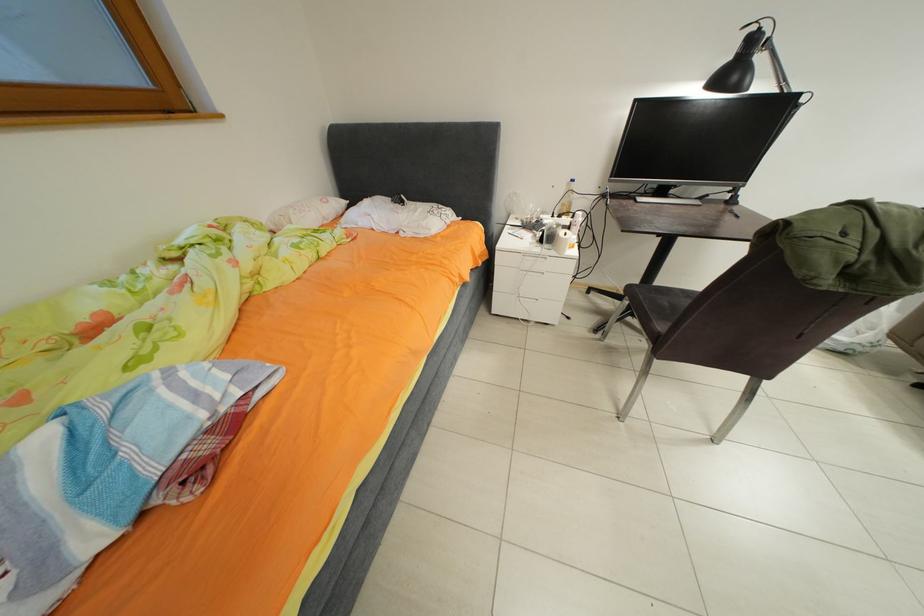
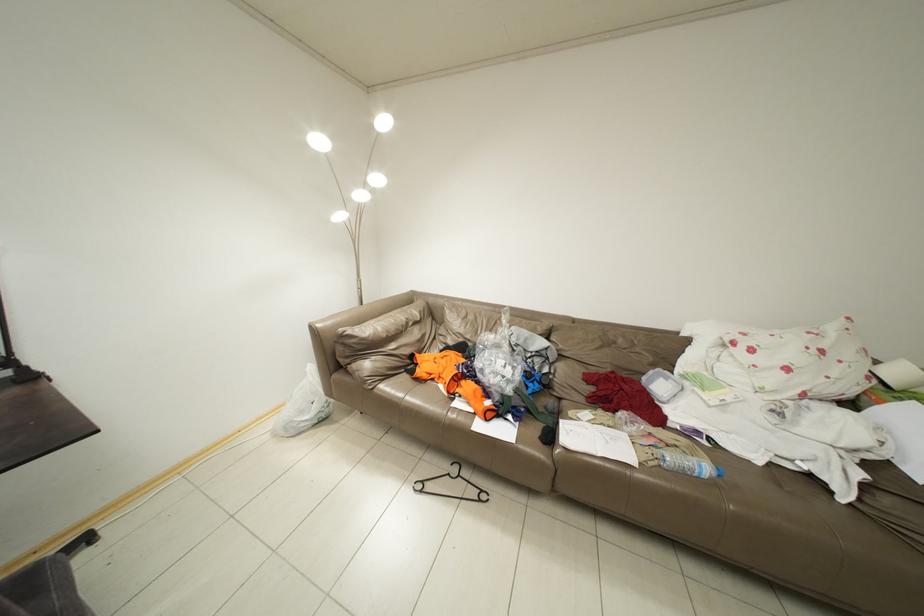
Question: How did the camera likely rotate?

Choices:
 (A) Left
 (B) Right
 (C) Up
 (D) Down

Answer: (B)